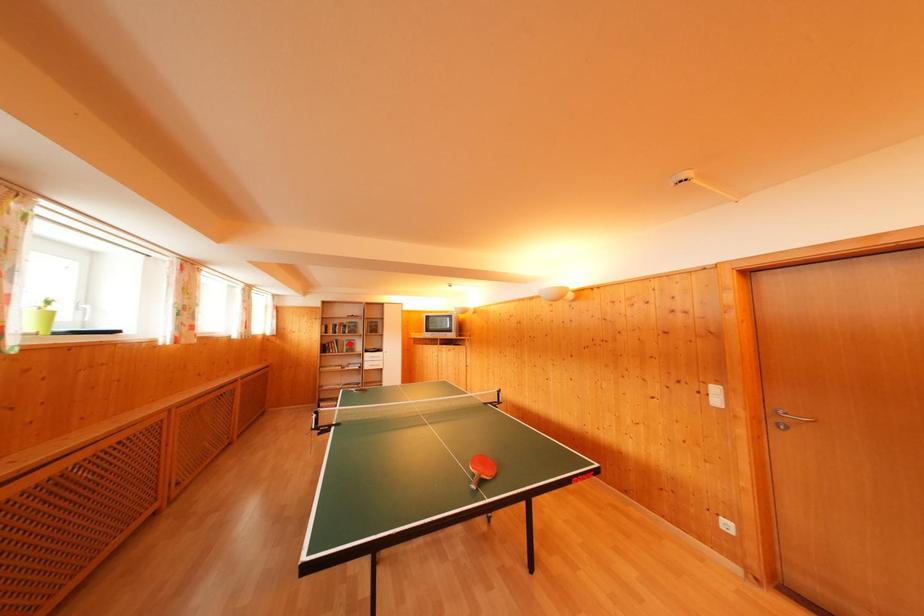
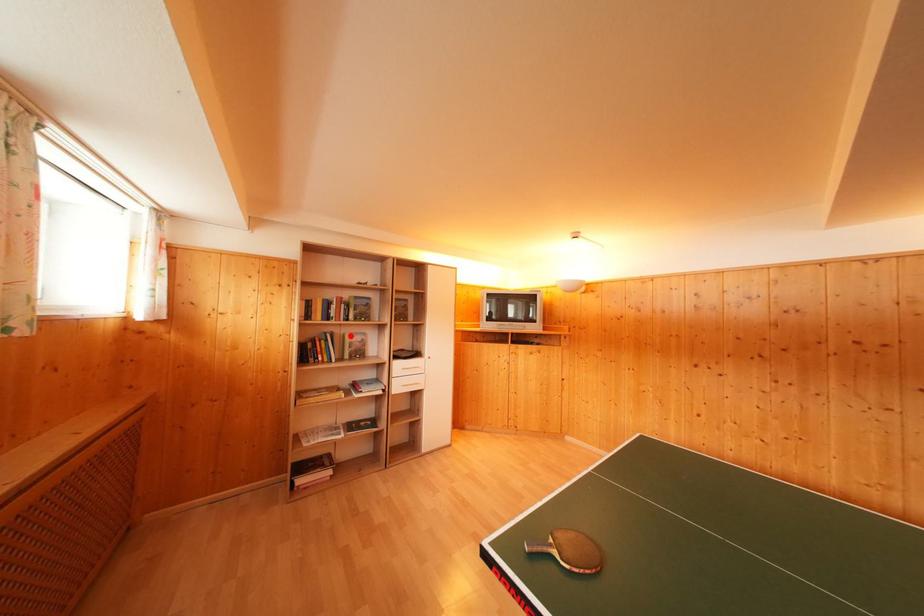
I am providing you with two images of the same scene from different viewpoints. A red point is marked on the first image and another point is marked on the second image. Do the highlighted points in image1 and image2 indicate the same real-world spot?

Yes